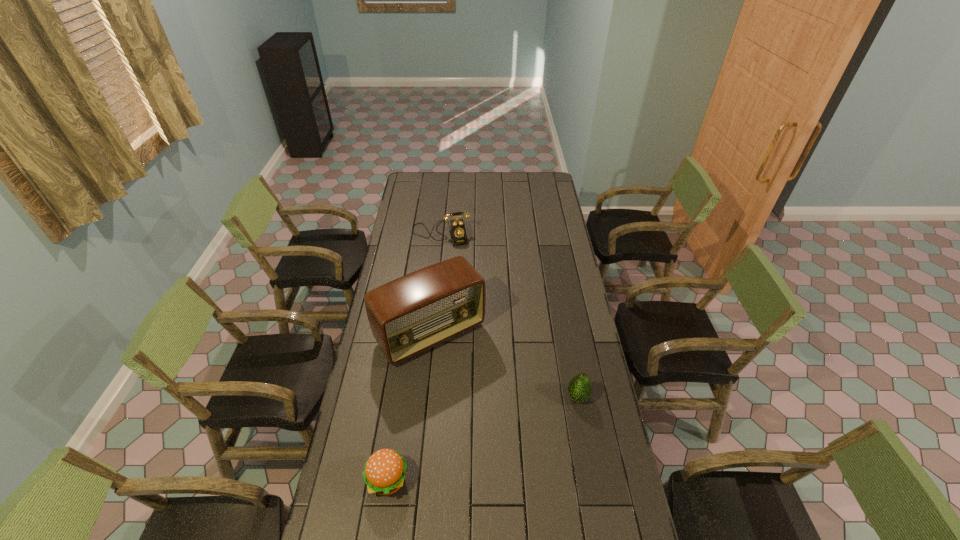
Where is `free space on the desktop that is between the hamburger and the avocado and is positioned on the front-facing side of the radio receiver`? free space on the desktop that is between the hamburger and the avocado and is positioned on the front-facing side of the radio receiver is located at coordinates (499, 431).

You are a GUI agent. You are given a task and a screenshot of the screen. Output one action in this format:
    pyautogui.click(x=<x>, y=<y>)
    Task: Click on the vacant spot on the desktop that is between the nearest object and the rightmost object and is positioned on the dial of the farthest object
    The width and height of the screenshot is (960, 540).
    Given the screenshot: What is the action you would take?
    pyautogui.click(x=483, y=438)